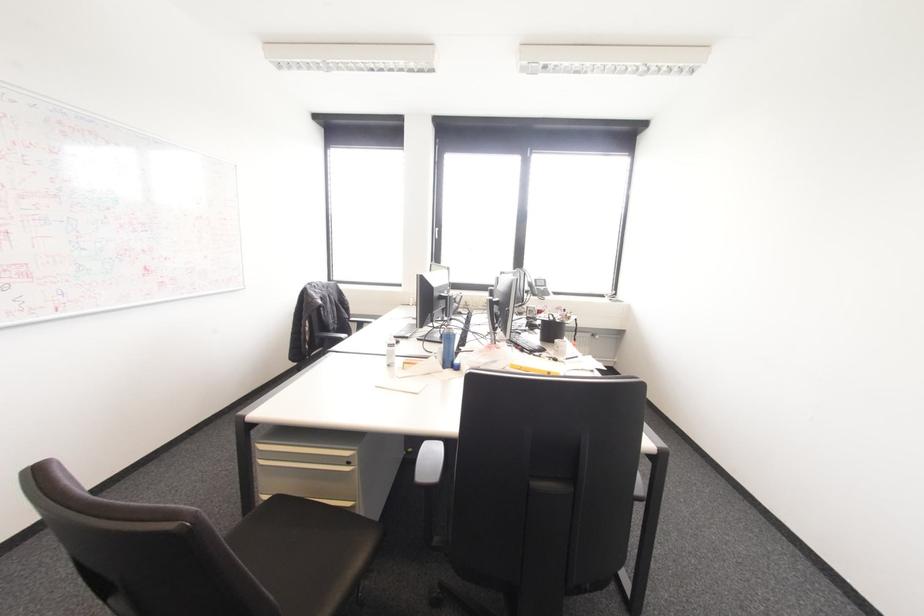
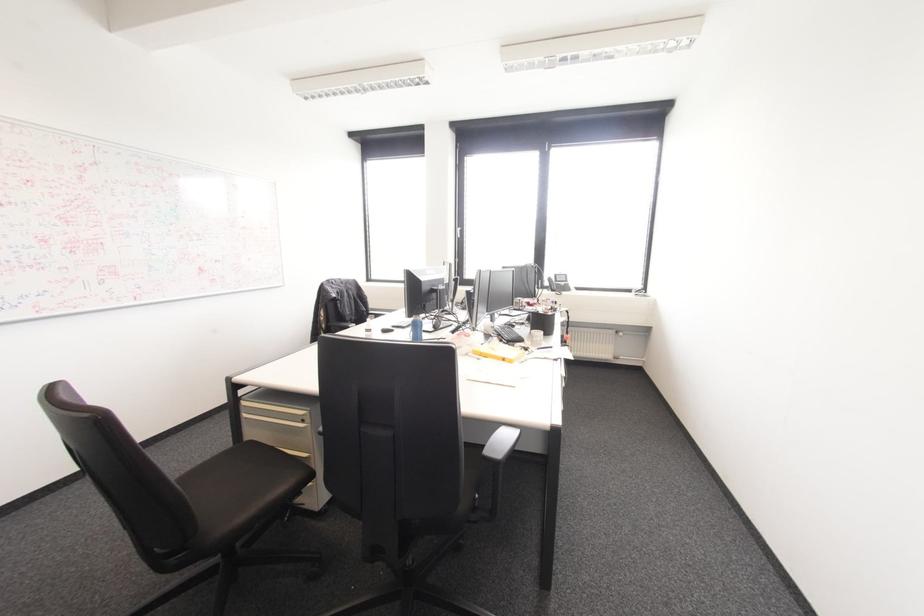
Find the pixel in the second image that matches (x=396, y=342) in the first image.

(392, 331)